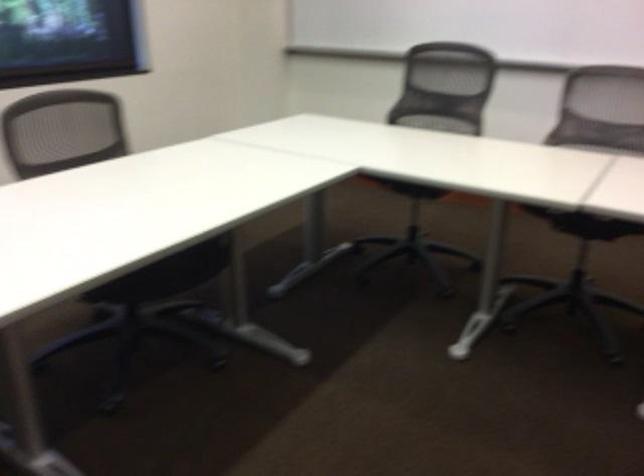
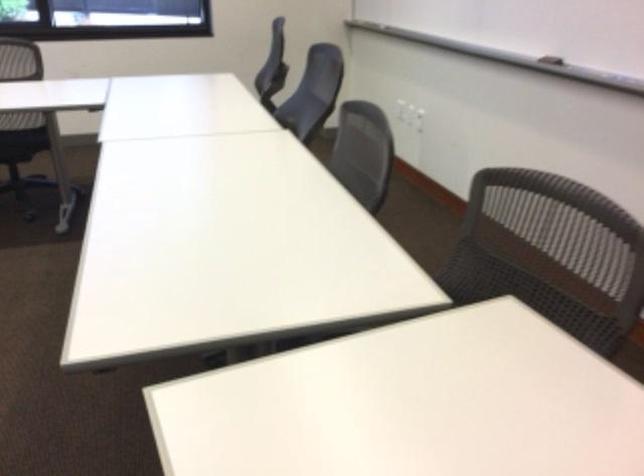
Question: I am providing you with two images of the same scene from different viewpoints. Which of the following objects are not visible in image2?

Choices:
 (A) chair sitting surface
 (B) small brown cup
 (C) whiteboard eraser
 (D) black chair sitting surface

Answer: (A)